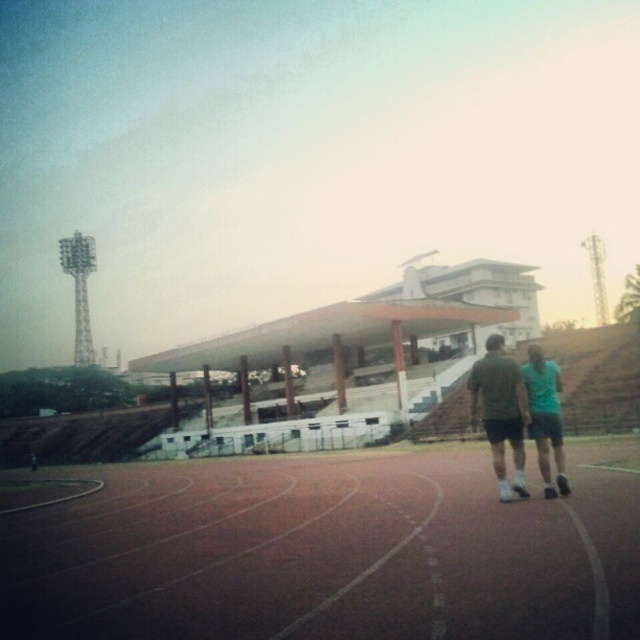
Question: Which object is closer to the camera taking this photo?

Choices:
 (A) dark gray shorts at center
 (B) teal fabric shorts at right
 (C) brown rubber track at center

Answer: (C)

Question: Which point is farther from the camera taking this photo?

Choices:
 (A) (496, 552)
 (B) (534, 356)
 (C) (500, 348)

Answer: (C)

Question: Is brown rubber track at center bigger than teal fabric shorts at right?

Choices:
 (A) no
 (B) yes

Answer: (A)

Question: From the image, what is the correct spatial relationship of brown rubber track at center in relation to teal fabric shorts at right?

Choices:
 (A) below
 (B) above

Answer: (A)

Question: Which point appears farthest from the camera in this image?

Choices:
 (A) (122, 624)
 (B) (538, 428)

Answer: (B)

Question: Does brown rubber track at center appear over dark gray shorts at center?

Choices:
 (A) no
 (B) yes

Answer: (B)